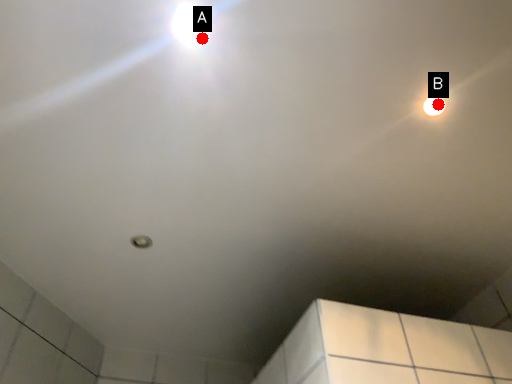
Question: Two points are circled on the image, labeled by A and B beside each circle. Which point appears farthest from the camera in this image?

Choices:
 (A) A is further
 (B) B is further

Answer: (B)